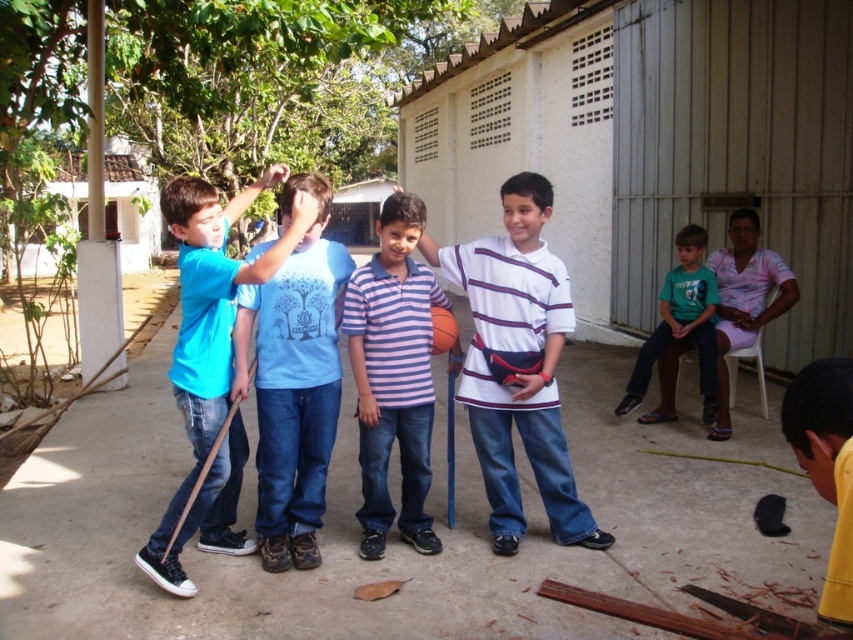
Does white striped shirt at center have a lesser height compared to purple striped polo shirt at center?

Yes.

Between white striped shirt at center and purple striped polo shirt at center, which one appears on the left side from the viewer's perspective?

Positioned to the left is purple striped polo shirt at center.

In order to click on white striped shirt at center in this screenshot , I will do `click(517, 364)`.

Is point (276, 442) less distant than point (386, 515)?

Yes, point (276, 442) is closer to viewer.

At what (x,y) coordinates should I click in order to perform the action: click on light blue cotton shirt at center. Please return your answer as a coordinate pair (x, y). This screenshot has height=640, width=853. Looking at the image, I should click on (294, 380).

The width and height of the screenshot is (853, 640). I want to click on light blue cotton shirt at center, so click(x=294, y=380).

Is point (265, 464) farther from viewer compared to point (664, 340)?

No.

You are a GUI agent. You are given a task and a screenshot of the screen. Output one action in this format:
    pyautogui.click(x=<x>, y=<y>)
    Task: Click on the light blue cotton shirt at center
    The width and height of the screenshot is (853, 640).
    Given the screenshot: What is the action you would take?
    pyautogui.click(x=294, y=380)